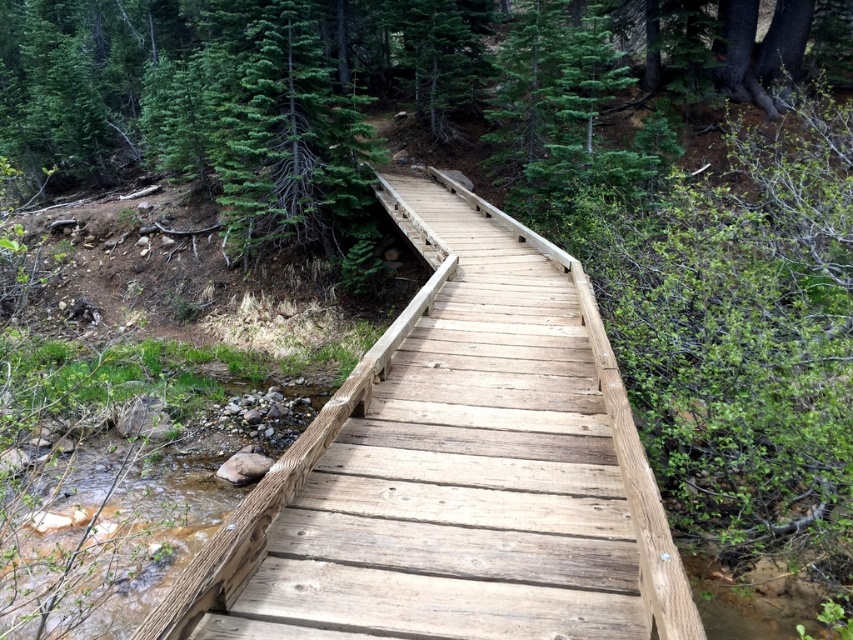
Question: Does natural wood bridge at center have a larger size compared to green matte tree at upper center?

Choices:
 (A) no
 (B) yes

Answer: (A)

Question: Considering the relative positions of natural wood bridge at center and green matte tree at upper center in the image provided, where is natural wood bridge at center located with respect to green matte tree at upper center?

Choices:
 (A) below
 (B) above

Answer: (A)

Question: In this image, where is natural wood bridge at center located relative to green matte tree at upper center?

Choices:
 (A) above
 (B) below

Answer: (B)

Question: Which point is farther from the camera taking this photo?

Choices:
 (A) click(234, 220)
 (B) click(532, 282)

Answer: (A)